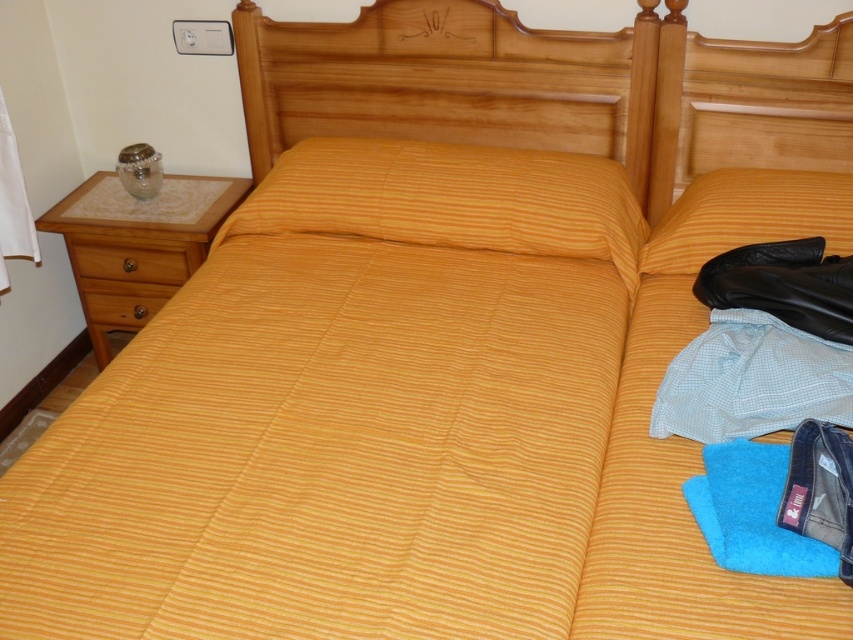
Question: Does wooden dresser at left have a lesser width compared to yellow striped pillow at upper right?

Choices:
 (A) yes
 (B) no

Answer: (B)

Question: Does wooden headboard at upper center appear on the left side of wooden dresser at left?

Choices:
 (A) no
 (B) yes

Answer: (A)

Question: Which object is closer to the camera taking this photo?

Choices:
 (A) wooden drawer at lower left
 (B) wooden drawer at left
 (C) wooden headboard at upper center
 (D) yellow striped pillow at upper right

Answer: (D)

Question: Which of the following is the farthest from the observer?

Choices:
 (A) (134, 244)
 (B) (103, 232)
 (C) (387, 84)

Answer: (C)

Question: Is wooden dresser at left to the right of wooden drawer at lower left from the viewer's perspective?

Choices:
 (A) yes
 (B) no

Answer: (B)

Question: Which point is farther from the camera taking this photo?

Choices:
 (A) (544, 88)
 (B) (688, 248)

Answer: (A)